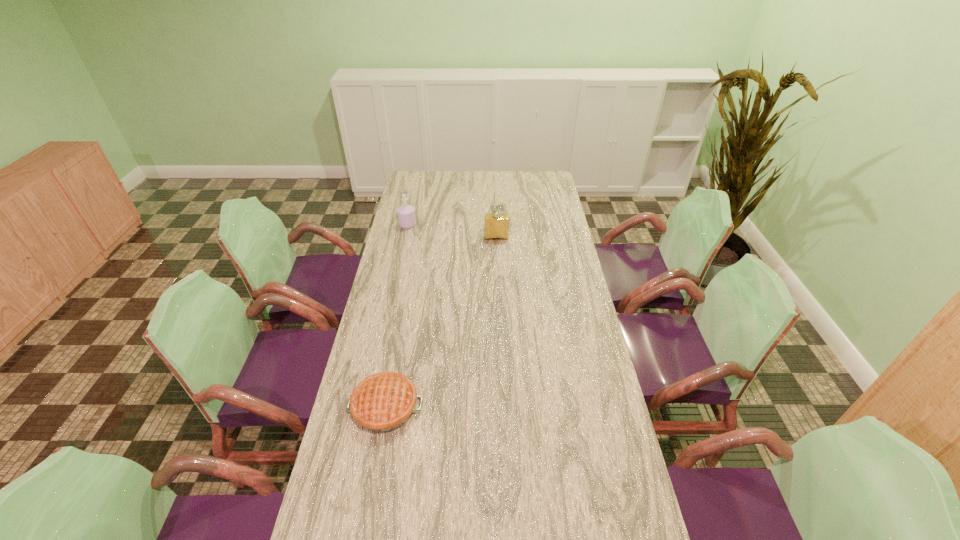
Image resolution: width=960 pixels, height=540 pixels. Find the location of `object that is the closest to the shortest object`. object that is the closest to the shortest object is located at coordinates (496, 225).

This screenshot has width=960, height=540. Identify the location of vacant space that satisfies the following two spatial constraints: 1. on the front side of the shortest object; 2. on the left side of the farthest object. click(368, 407).